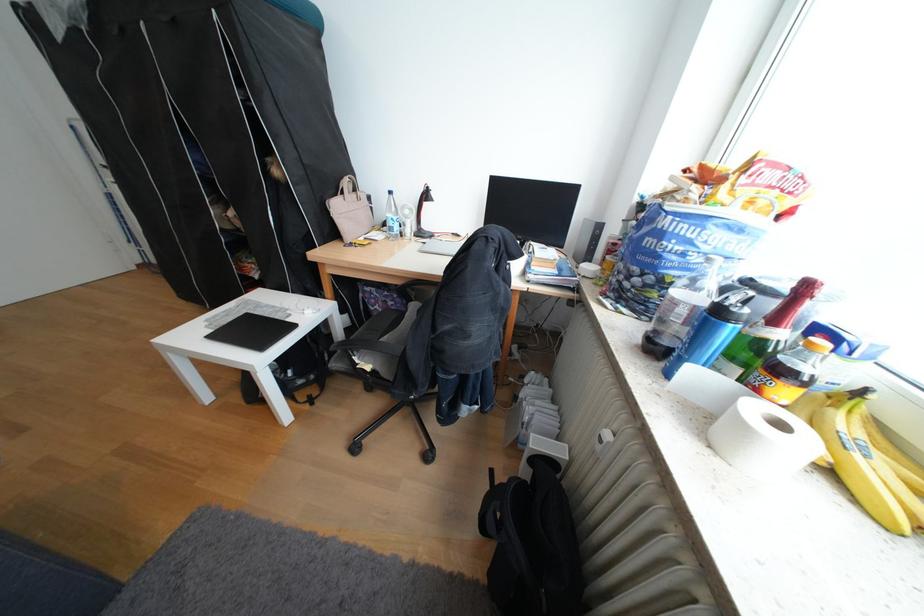
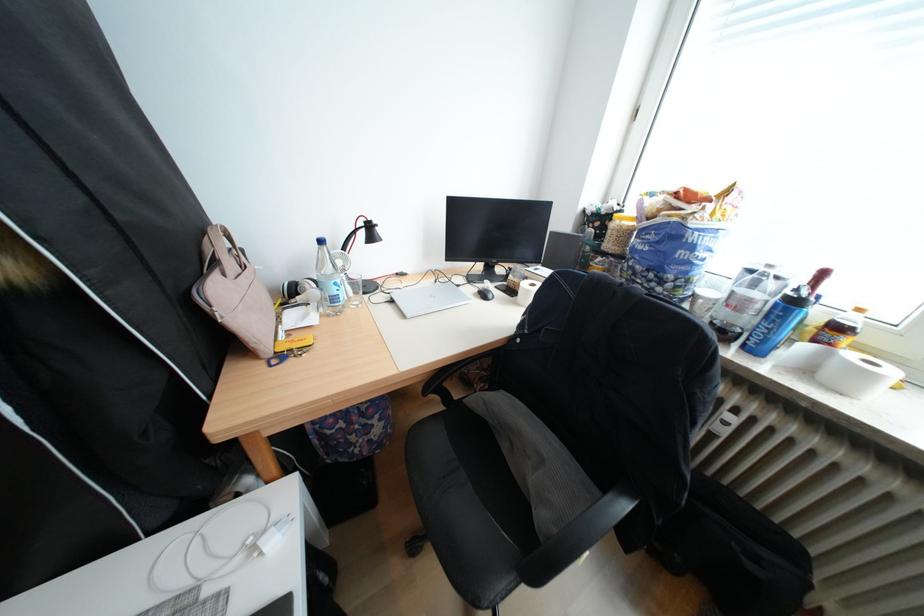
Where in the second image is the point corresponding to point 355,193 from the first image?

(227, 264)